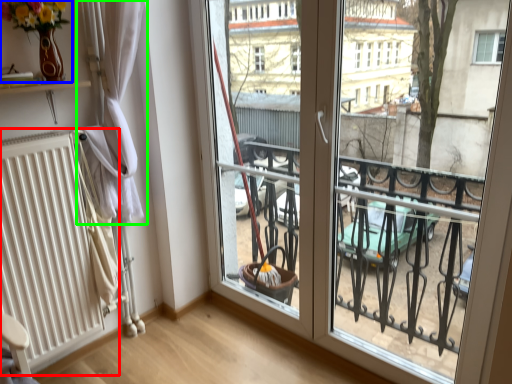
Question: Estimate the real-world distances between objects in this image. Which object is farther from radiator (highlighted by a red box), floral arrangement (highlighted by a blue box) or curtain (highlighted by a green box)?

Choices:
 (A) floral arrangement
 (B) curtain

Answer: (A)